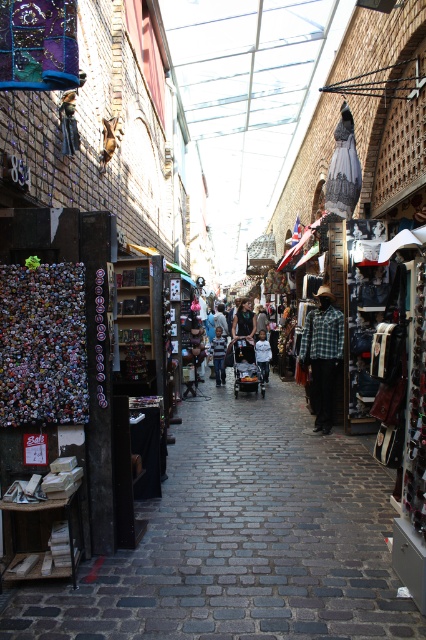
Is smooth wooden shelves at center bigger than striped shirt at center?

No.

Where is `smooth wooden shelves at center`? The image size is (426, 640). smooth wooden shelves at center is located at coordinates (241, 540).

Identify the location of smooth wooden shelves at center. The image size is (426, 640). (241, 540).

This screenshot has width=426, height=640. I want to click on smooth wooden shelves at center, so 241,540.

Does smooth wooden shelves at center have a lesser height compared to white cotton shirt at center?

Yes.

Does smooth wooden shelves at center appear on the left side of white cotton shirt at center?

Yes, smooth wooden shelves at center is to the left of white cotton shirt at center.

Where is `smooth wooden shelves at center`? The image size is (426, 640). smooth wooden shelves at center is located at coordinates (241, 540).

Identify the location of smooth wooden shelves at center. (241, 540).

Can you confirm if smooth wooden shelves at center is thinner than flannel shirt at center?

In fact, smooth wooden shelves at center might be wider than flannel shirt at center.

Does smooth wooden shelves at center have a smaller size compared to flannel shirt at center?

Indeed, smooth wooden shelves at center has a smaller size compared to flannel shirt at center.

Is point (238, 572) farther from viewer compared to point (331, 420)?

No, it is not.

What are the coordinates of `smooth wooden shelves at center` in the screenshot? It's located at (241, 540).